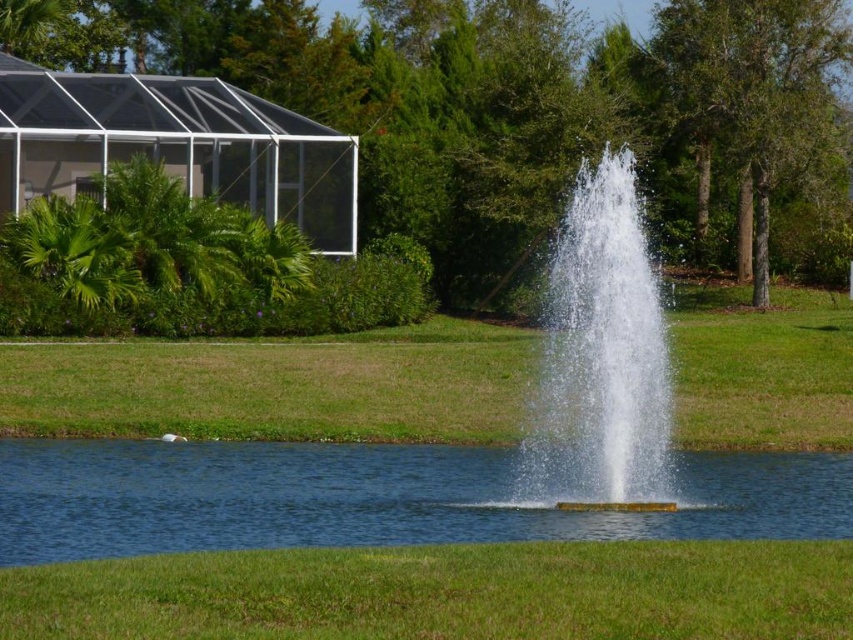
Who is taller, clear blue water at center or clear water fountain at center?

Standing taller between the two is clear water fountain at center.

Can you confirm if clear blue water at center is bigger than clear water fountain at center?

Actually, clear blue water at center might be smaller than clear water fountain at center.

Who is more distant from viewer, (780, 454) or (665, 429)?

Positioned behind is point (780, 454).

Locate an element on the screen. This screenshot has width=853, height=640. clear blue water at center is located at coordinates (369, 497).